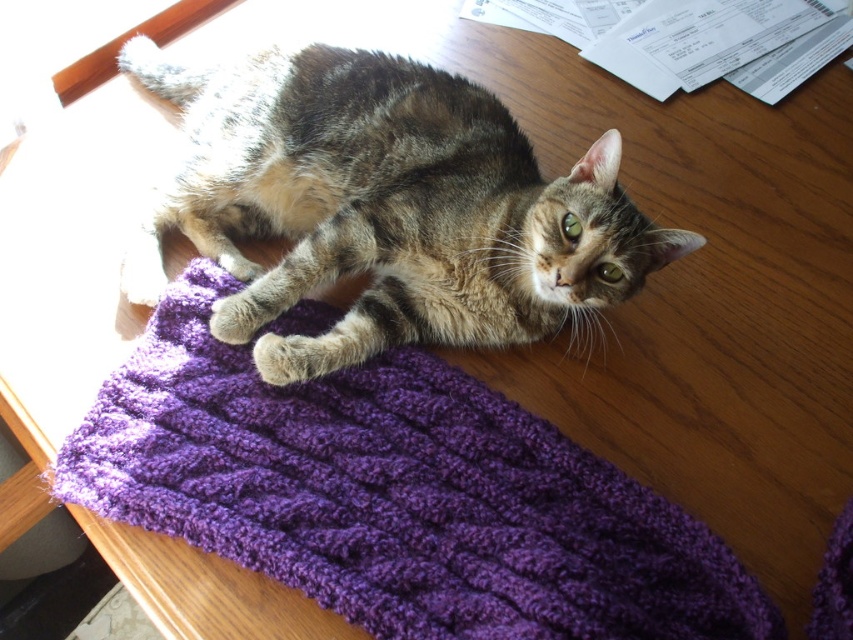
This screenshot has height=640, width=853. What do you see at coordinates (395, 493) in the screenshot?
I see `purple knitted mat at upper center` at bounding box center [395, 493].

From the picture: Who is positioned more to the left, purple knitted mat at upper center or tabby fur cat at center?

tabby fur cat at center is more to the left.

Is point (363, 616) closer to viewer compared to point (233, 332)?

That is True.

I want to click on purple knitted mat at upper center, so click(x=395, y=493).